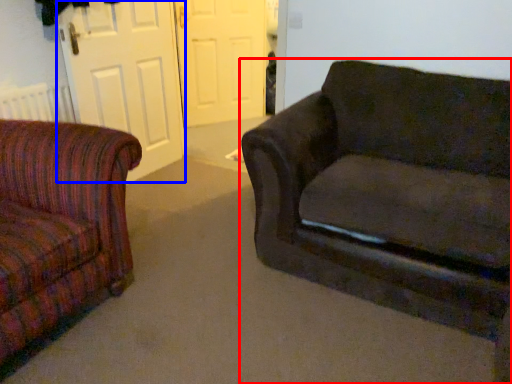
Question: Which point is further to the camera, studio couch (highlighted by a red box) or screen door (highlighted by a blue box)?

Choices:
 (A) studio couch
 (B) screen door

Answer: (B)